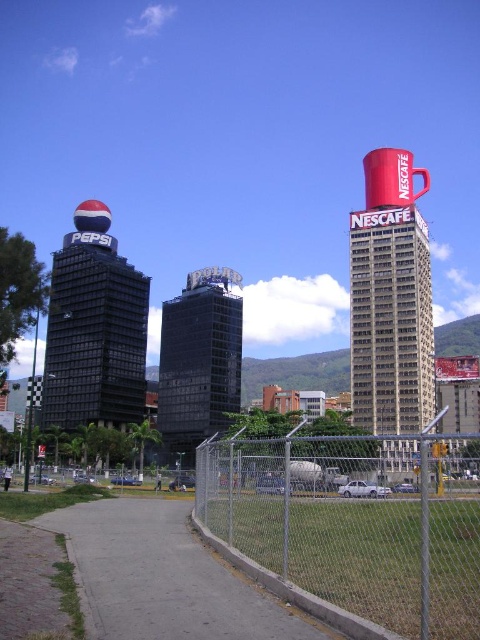
You are a drone operator tasked with flying a drone between the shiny black building at left and the black glass building at center. The drone has a maximum flight distance of 15 meters. Can the drone safely travel between these two buildings without exceeding its range?

The distance between the shiny black building at left and the black glass building at center is 14.13 meters, which is within the drone operator drone has a maximum flight distance of 15 meters. The drone can safely travel between them without exceeding its range.